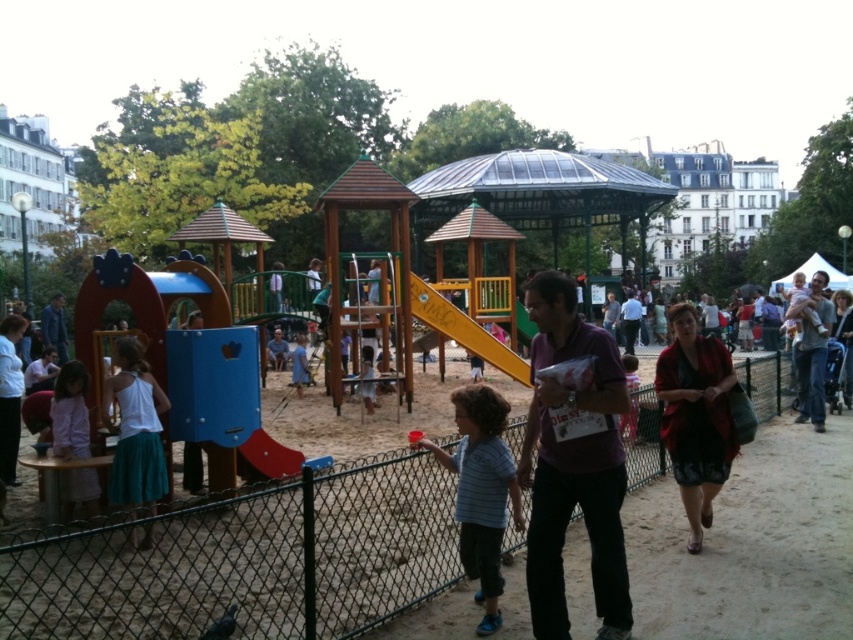
Describe the element at coordinates (811, 349) in the screenshot. I see `matte brown shirt at right` at that location.

Which is more to the right, matte brown shirt at right or blue fabric jacket at left?

From the viewer's perspective, matte brown shirt at right appears more on the right side.

Does point (810, 339) come farther from viewer compared to point (54, 317)?

No.

At what (x,y) coordinates should I click in order to perform the action: click on matte brown shirt at right. Please return your answer as a coordinate pair (x, y). Looking at the image, I should click on (811, 349).

Can you confirm if green chain-link fence at center is positioned to the left of red plastic slide at center?

In fact, green chain-link fence at center is to the right of red plastic slide at center.

Where is `green chain-link fence at center`? green chain-link fence at center is located at coordinates click(x=245, y=561).

Identify the location of green chain-link fence at center. (245, 561).

Who is more distant from viewer, [718,458] or [306,381]?

Positioned behind is point [306,381].

The height and width of the screenshot is (640, 853). What are the coordinates of `matte red jacket at right` in the screenshot? It's located at (695, 416).

Find the location of a particular element. matte red jacket at right is located at coordinates (695, 416).